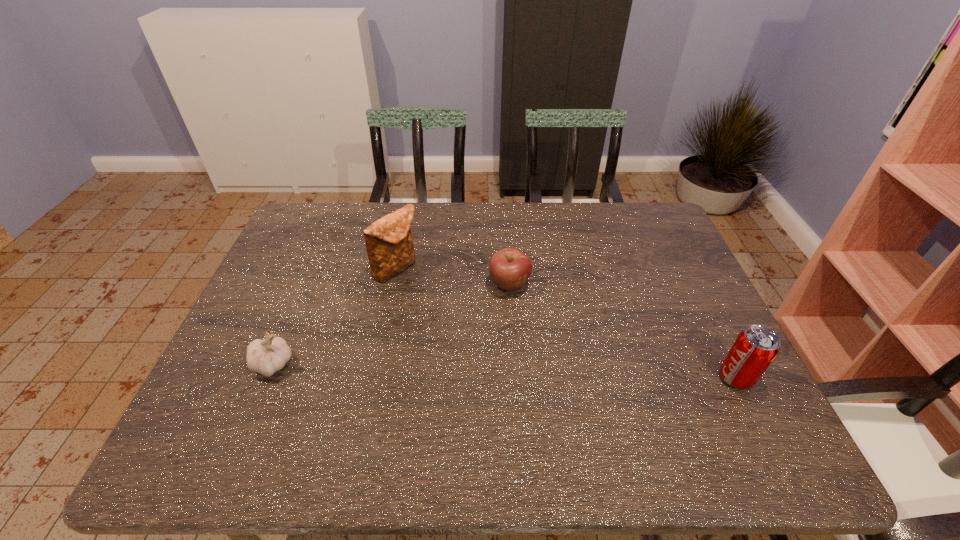
You are a GUI agent. You are given a task and a screenshot of the screen. Output one action in this format:
    pyautogui.click(x=<x>, y=<y>)
    Task: Click on the free space at the far edge
    
    Given the screenshot: What is the action you would take?
    pyautogui.click(x=429, y=202)

Locate an element on the screen. This screenshot has width=960, height=540. blank space at the near edge of the desktop is located at coordinates (571, 414).

Identify the location of free space at the left edge of the desktop. (326, 255).

This screenshot has width=960, height=540. In the image, there is a desktop. Find the location of `free space at the right edge`. free space at the right edge is located at coordinates (637, 253).

You are a GUI agent. You are given a task and a screenshot of the screen. Output one action in this format:
    pyautogui.click(x=<x>, y=<y>)
    Task: Click on the free space at the far left corner of the desktop
    
    Given the screenshot: What is the action you would take?
    pyautogui.click(x=300, y=218)

Identify the location of free space at the far right corner of the desktop. This screenshot has width=960, height=540. (642, 226).

Identify the location of free space between the soda can and the second shortest object. (504, 371).

This screenshot has height=540, width=960. I want to click on free spot between the second object from right to left and the soda can, so click(623, 330).

Find the location of `empty space that is in between the clutch bag and the leftmost object`. empty space that is in between the clutch bag and the leftmost object is located at coordinates (334, 317).

What are the coordinates of `empty location between the soda can and the garlic` in the screenshot? It's located at (504, 371).